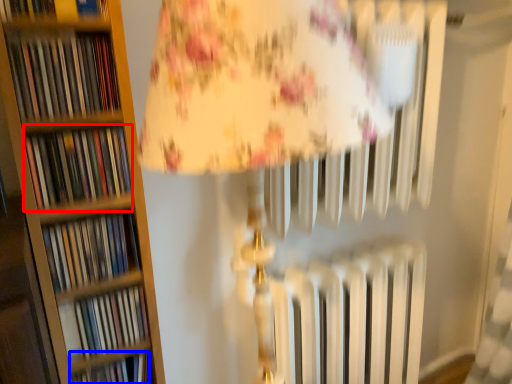
Question: Which point is closer to the camera, book (highlighted by a red box) or book (highlighted by a blue box)?

Choices:
 (A) book
 (B) book

Answer: (A)